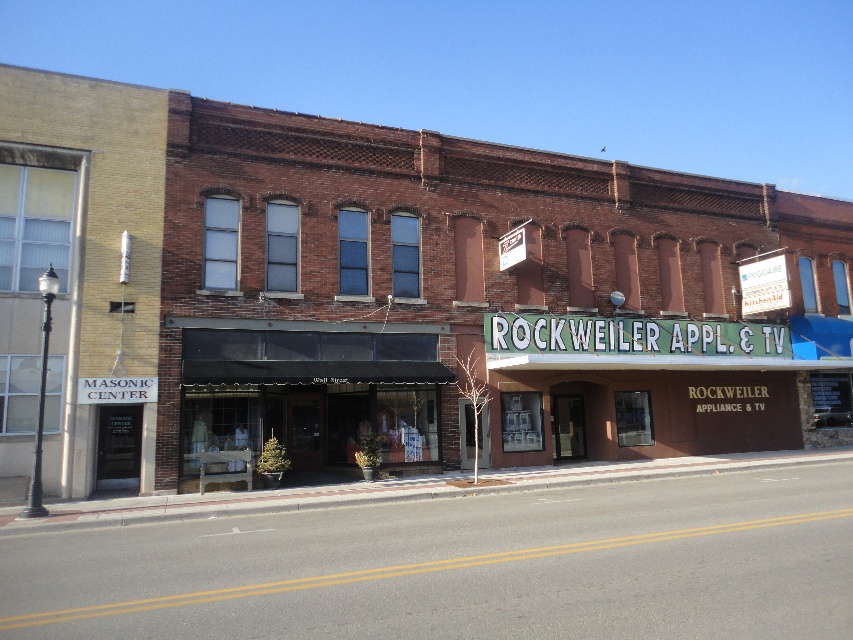
You are a delivery person standing 5 meters away from the brown brick building at center. You need to place a package under the matte black awning at center. Can you reach the awning without moving closer than your current position?

The brown brick building at center is 9.40 meters away from the matte black awning at center. Since you are currently 5 meters away from the building, you are still 4.4 meters away from the awning. Therefore, you need to move closer to reach it.

You are a window washer standing on the ground floor. You need to clean the windows of the brown brick building at center and the matte black awning at center. Which one will require you to climb higher to reach?

The brown brick building at center is taller than the matte black awning at center, so you will need to climb higher to reach the brown brick building at center.

You are a delivery person trying to park your van in front of the RO. storefront. The van is 2 meters wide. The brown brick building at center and the matte black awning at center are in the way. Can you fit your van between them?

The brown brick building at center is wider than the matte black awning at center, so there may not be enough space between them for the van. Check the exact measurements before deciding.